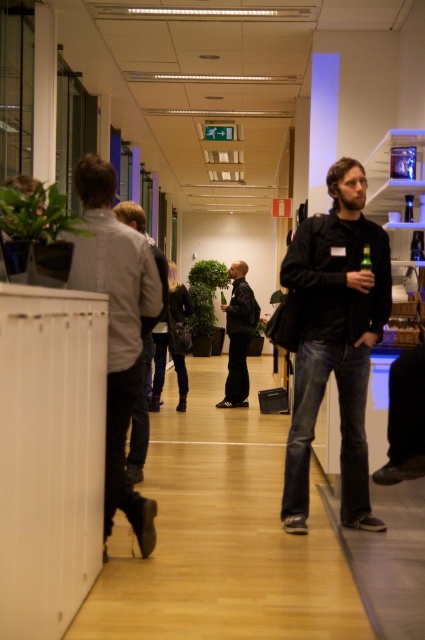
You are organizing a photo shoot in this office corridor and need to place two mannequins wearing the matte black jacket at center and the light gray fabric jacket at left. If the mannequin for the matte black jacket is 1.5 meters tall, what should be the minimum height of the mannequin for the light gray fabric jacket to maintain proportional sizing?

The light gray fabric jacket at left is larger than the matte black jacket at center. Since the matte black jacket mannequin is 1.5 meters tall, the light gray fabric jacket mannequin should be taller than 1.5 meters to maintain proportional sizing based on their relative sizes.

You are a photographer positioned at one end of the corridor. You need to take a photo of both the matte black jacket at center and the dark blue leather jacket at center so that both are clearly visible. Which jacket should you focus on first to ensure proper depth of field?

The matte black jacket at center is taller than the dark blue leather jacket at center, so focusing on the taller matte black jacket at center first will help ensure both are in focus due to its greater height requiring more depth of field.